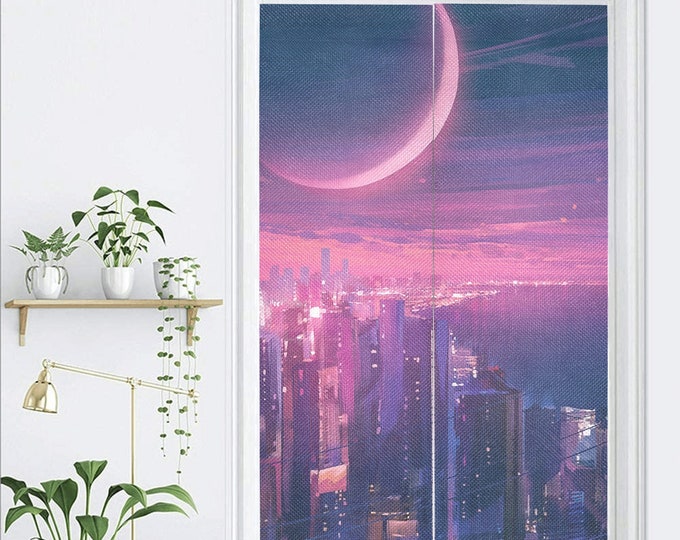
I want to click on white molding, so click(251, 271), click(625, 271).